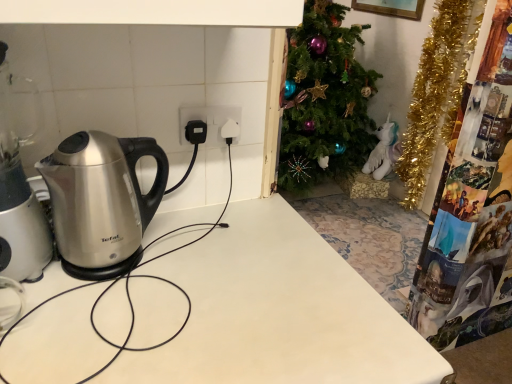
Question: Is white glossy table at center taller or shorter than satin silver kettle at left?

Choices:
 (A) tall
 (B) short

Answer: (B)

Question: In terms of size, does white glossy table at center appear bigger or smaller than satin silver kettle at left?

Choices:
 (A) big
 (B) small

Answer: (A)

Question: Which object is the farthest from the satin silver kettle at left?

Choices:
 (A) white plastic socket at center
 (B) white glossy table at center

Answer: (A)

Question: Estimate the real-world distances between objects in this image. Which object is closer to the white plastic socket at center?

Choices:
 (A) satin silver kettle at left
 (B) white glossy table at center

Answer: (A)